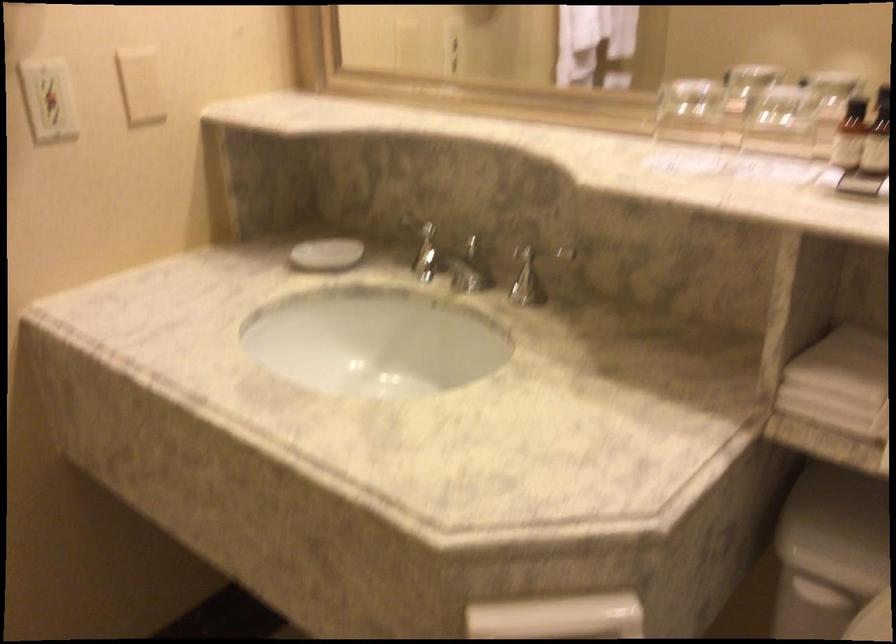
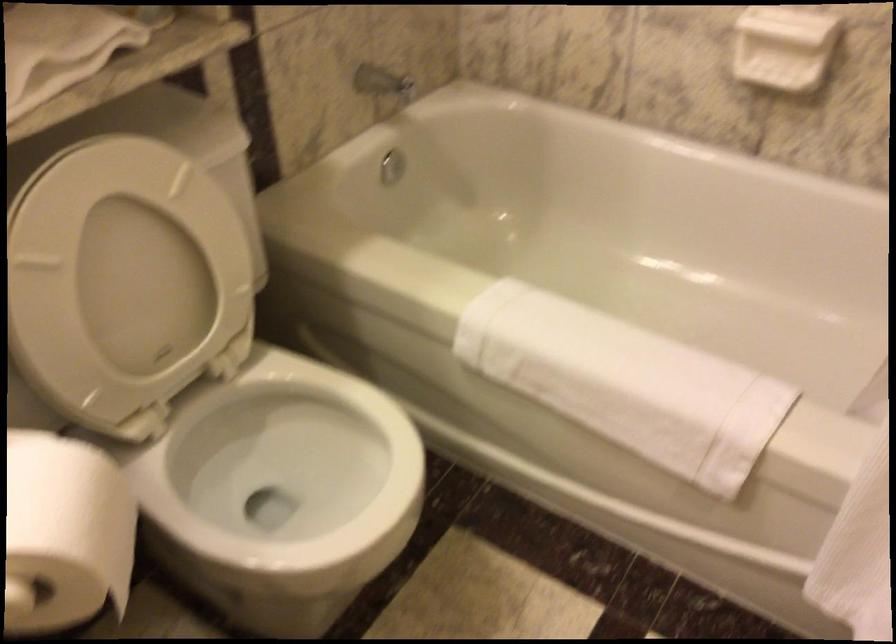
Looking at this image, how did the camera likely rotate?

The rotation direction of the camera is right-down.